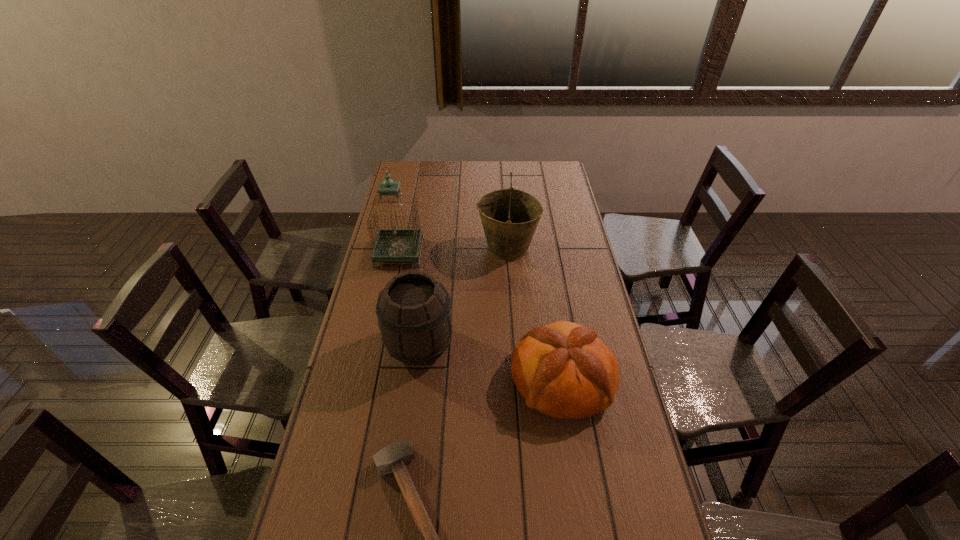
Find the location of a particular element. The width and height of the screenshot is (960, 540). birdcage situated at the left edge is located at coordinates (391, 245).

Where is `wine bucket that is at the left edge`? Image resolution: width=960 pixels, height=540 pixels. wine bucket that is at the left edge is located at coordinates (414, 314).

Where is `object that is at the right edge`? This screenshot has width=960, height=540. object that is at the right edge is located at coordinates (562, 370).

Find the location of a particular element. This screenshot has height=540, width=960. vacant space at the far edge of the desktop is located at coordinates (529, 185).

The width and height of the screenshot is (960, 540). In the image, there is a desktop. In order to click on free space at the left edge in this screenshot , I will do `click(312, 471)`.

Locate an element on the screen. This screenshot has width=960, height=540. vacant space at the right edge is located at coordinates (599, 296).

I want to click on vacant space at the far left corner of the desktop, so click(420, 180).

The image size is (960, 540). I want to click on vacant space at the far right corner, so click(546, 173).

I want to click on vacant area that lies between the fourth tallest object and the birdcage, so 480,316.

I want to click on free space between the fourth tallest object and the nearer wine bucket, so click(x=491, y=362).